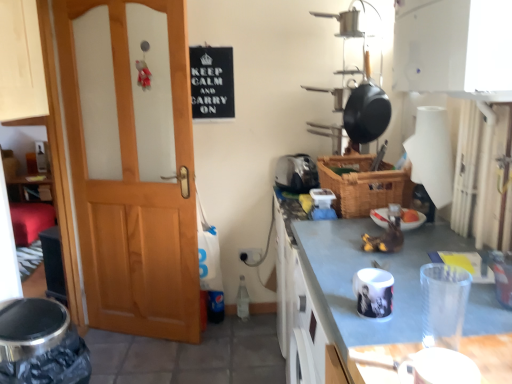
Where is `empty space that is ontop of white glossy cabinet at upper center (from a real-world perspective)`? The width and height of the screenshot is (512, 384). empty space that is ontop of white glossy cabinet at upper center (from a real-world perspective) is located at coordinates (406, 259).